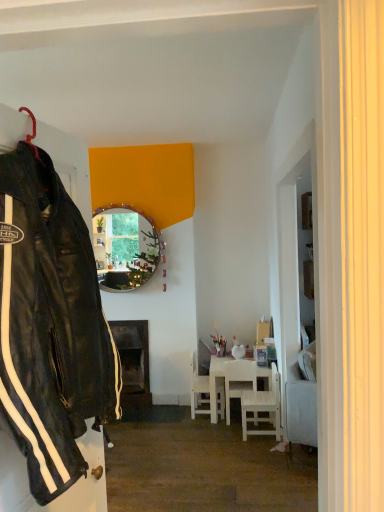
Question: Is white matte chair at center, placed as the 3th chair when sorted from front to back, at the back of white wooden chair at lower right, positioned as the third chair in back-to-front order?

Choices:
 (A) yes
 (B) no

Answer: (B)

Question: Can you confirm if white wooden chair at lower right, the first chair when ordered from front to back, is wider than white matte chair at center, placed as the 3th chair when sorted from front to back?

Choices:
 (A) yes
 (B) no

Answer: (A)

Question: Does white wooden chair at lower right, positioned as the third chair in back-to-front order, have a smaller size compared to white matte chair at center, the 1th chair positioned from the back?

Choices:
 (A) yes
 (B) no

Answer: (B)

Question: Does white wooden chair at lower right, the first chair when ordered from front to back, turn towards white matte chair at center, placed as the 3th chair when sorted from front to back?

Choices:
 (A) no
 (B) yes

Answer: (A)

Question: Is white wooden chair at lower right, the first chair when ordered from front to back, completely or partially outside of white matte chair at center, placed as the 3th chair when sorted from front to back?

Choices:
 (A) no
 (B) yes

Answer: (B)

Question: Would you say white matte chair at center, the 1th chair positioned from the back, is to the left or to the right of white wooden chair at lower right, the first chair when ordered from front to back, in the picture?

Choices:
 (A) left
 (B) right

Answer: (A)

Question: Based on their sizes in the image, would you say white matte chair at center, the 1th chair positioned from the back, is bigger or smaller than white wooden chair at lower right, positioned as the third chair in back-to-front order?

Choices:
 (A) big
 (B) small

Answer: (B)

Question: From a real-world perspective, is white matte chair at center, placed as the 3th chair when sorted from front to back, positioned above or below white wooden chair at lower right, positioned as the third chair in back-to-front order?

Choices:
 (A) below
 (B) above

Answer: (B)

Question: Do you think white matte chair at center, the 1th chair positioned from the back, is within white wooden chair at lower right, the first chair when ordered from front to back, or outside of it?

Choices:
 (A) inside
 (B) outside

Answer: (B)

Question: Does point (193, 352) appear closer or farther from the camera than point (249, 371)?

Choices:
 (A) closer
 (B) farther

Answer: (B)

Question: Relative to white wooden chair at center, arranged as the 2th chair when viewed from the back, is white matte chair at center, placed as the 3th chair when sorted from front to back, in front or behind?

Choices:
 (A) behind
 (B) front

Answer: (A)

Question: Considering the positions of white matte chair at center, placed as the 3th chair when sorted from front to back, and white wooden chair at center, the second chair in the front-to-back sequence, in the image, is white matte chair at center, placed as the 3th chair when sorted from front to back, wider or thinner than white wooden chair at center, the second chair in the front-to-back sequence,?

Choices:
 (A) wide
 (B) thin

Answer: (A)

Question: Considering the relative positions of white matte chair at center, the 1th chair positioned from the back, and white wooden chair at center, arranged as the 2th chair when viewed from the back, in the image provided, is white matte chair at center, the 1th chair positioned from the back, to the left or to the right of white wooden chair at center, arranged as the 2th chair when viewed from the back,?

Choices:
 (A) right
 (B) left

Answer: (B)

Question: In the image, is matte circular mirror at center positioned in front of or behind white wooden chair at lower right, the first chair when ordered from front to back?

Choices:
 (A) front
 (B) behind

Answer: (B)

Question: Is matte circular mirror at center inside or outside of white wooden chair at lower right, positioned as the third chair in back-to-front order?

Choices:
 (A) inside
 (B) outside

Answer: (B)